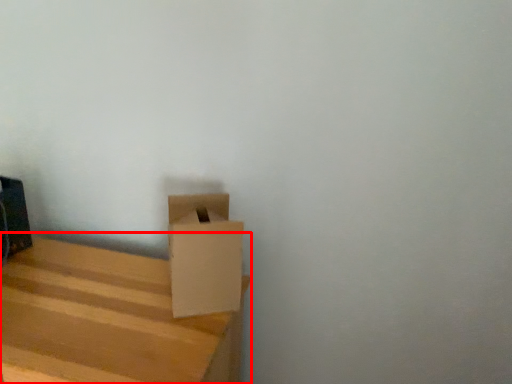
Question: Where is furniture (annotated by the red box) located in relation to cardboard box in the image?

Choices:
 (A) right
 (B) left

Answer: (B)